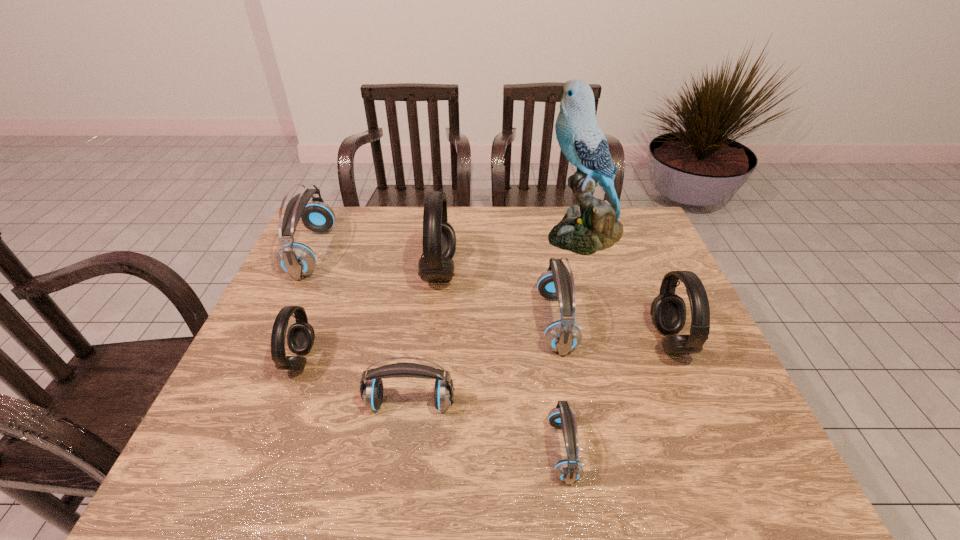
Image resolution: width=960 pixels, height=540 pixels. In order to click on parakeet in this screenshot , I will do `click(596, 227)`.

Locate an element on the screen. Image resolution: width=960 pixels, height=540 pixels. the second gray headset from left to right is located at coordinates (439, 239).

Image resolution: width=960 pixels, height=540 pixels. I want to click on the farthest gray headset, so coord(439,239).

Find the location of a particular element. the farthest blue headset is located at coordinates (298, 260).

In order to click on the leftmost headset in this screenshot , I will do `click(298, 260)`.

This screenshot has height=540, width=960. Identify the location of the rightmost headset. (668, 310).

At what (x,y) coordinates should I click in order to perform the action: click on the second biggest gray headset. Please return your answer as a coordinate pair (x, y). Image resolution: width=960 pixels, height=540 pixels. Looking at the image, I should click on (668, 310).

This screenshot has height=540, width=960. Identify the location of the third nearest blue headset. (564, 335).

The width and height of the screenshot is (960, 540). I want to click on the leftmost gray headset, so click(300, 337).

Find the location of `the smallest gray headset`. the smallest gray headset is located at coordinates (300, 337).